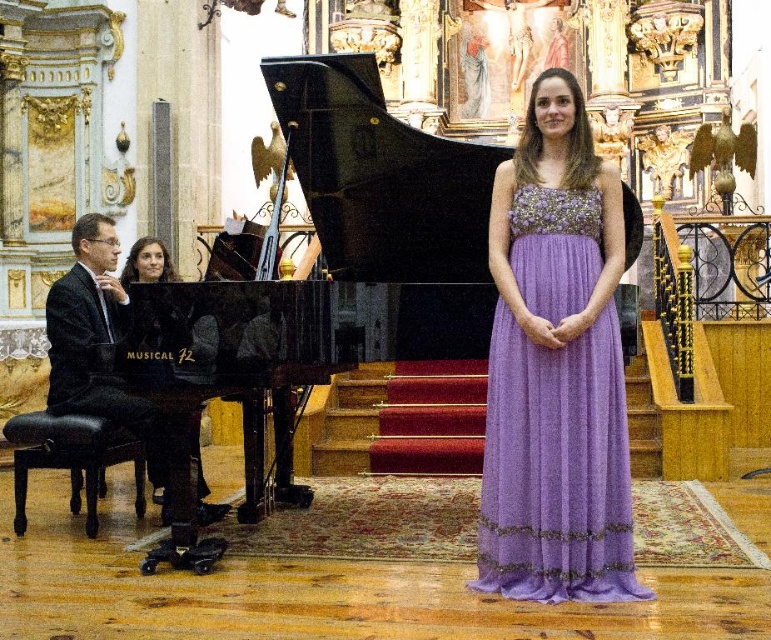
You are an event planner designing a layout for a charity gala. You need to place a 2.5 meter tall statue in the center of the room. The statue will occupy the space where the point at coordinates (x=556, y=467) currently is. Will the statue block the view of the lavender chiffon dress at center from the front entrance?

The point at coordinates (x=556, y=467) is on the lavender chiffon dress at center, so placing a 2.5 meter tall statue there would block the view of the lavender chiffon dress at center from the front entrance.

You are an event planner arranging a photoshoot in the cathedral. You need to position a camera at point A to capture the lavender chiffon dress at center. What is the best direction to aim the camera based on its location?

The lavender chiffon dress at center is located at point (556, 467), so the camera should be aimed towards those coordinates to capture it effectively.

In the grand cathedral setting, you notice a lavender chiffon dress at center and a matte black piano at left. From the perspective of someone standing at the entrance facing the stage, which object is positioned more to the right?

The lavender chiffon dress at center is positioned to the right of the matte black piano at left, so it is more to the right.